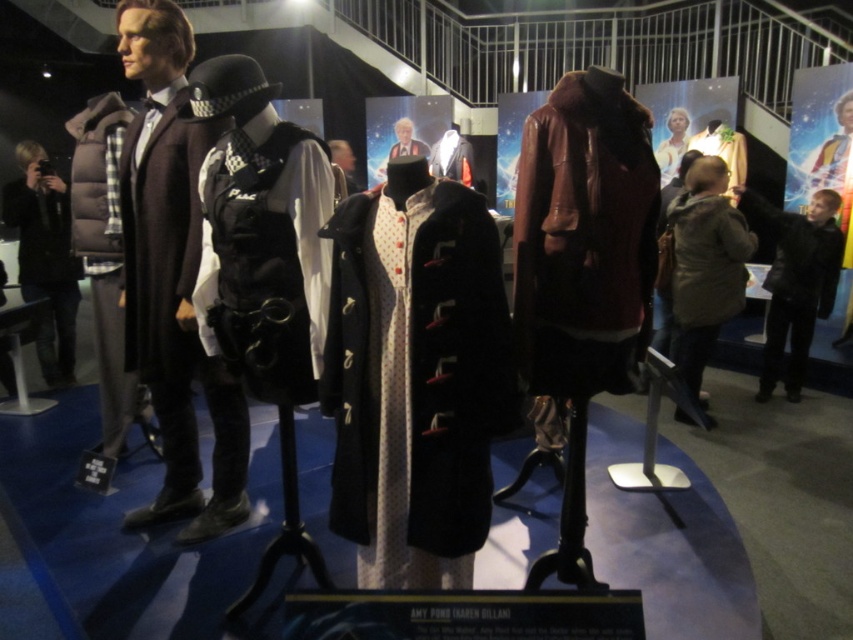
You are standing in front of the costume display. There are two points marked in the scene. The first point is at coordinates point (256, 184) and the second point is at point (675, 156). Which point is closer to you?

Point (256, 184) is closer to the viewer than point (675, 156).

You are a costume designer trying to fit a new accessory onto the velvet black vest at center and the velvet burgundy coat at center. Which costume will require a wider accessory to match its size?

The velvet burgundy coat at center requires a wider accessory because its width is greater than the velvet black vest at center.